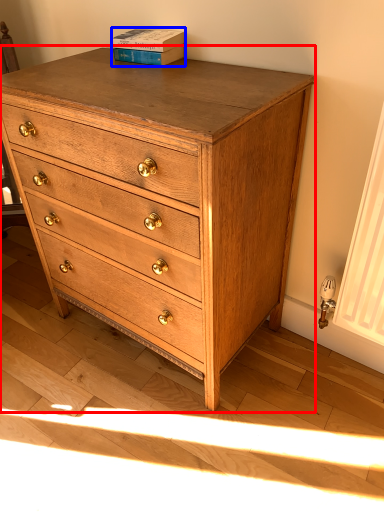
Question: Which object appears closest to the camera in this image, chest of drawers (highlighted by a red box) or paperback book (highlighted by a blue box)?

Choices:
 (A) chest of drawers
 (B) paperback book

Answer: (A)